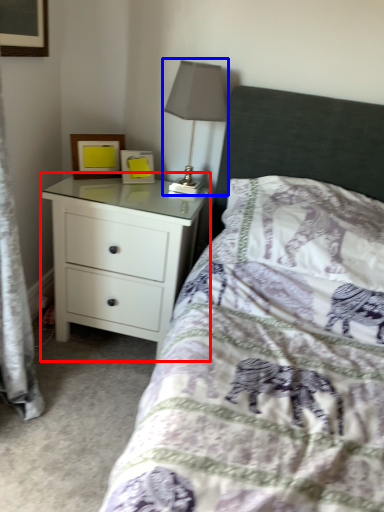
Question: Among these objects, which one is farthest to the camera, chest of drawers (highlighted by a red box) or table lamp (highlighted by a blue box)?

Choices:
 (A) chest of drawers
 (B) table lamp

Answer: (A)